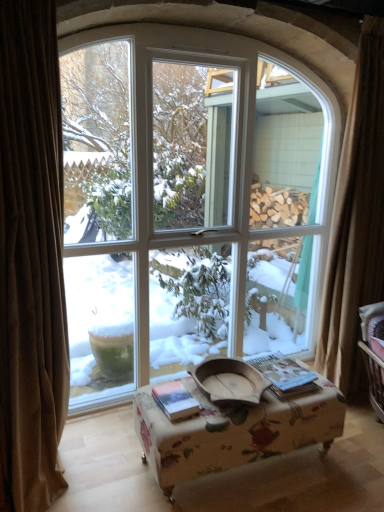
Question: From the image's perspective, is hardcover book at center, marked as the 1th book in a left-to-right arrangement, over brown curtain at right, marked as the second curtain in a left-to-right arrangement?

Choices:
 (A) no
 (B) yes

Answer: (A)

Question: From the image's perspective, is hardcover book at center, marked as the 1th book in a left-to-right arrangement, under brown curtain at right, marked as the first curtain in a back-to-front arrangement?

Choices:
 (A) no
 (B) yes

Answer: (B)

Question: Could you tell me if hardcover book at center, marked as the 1th book in a left-to-right arrangement, is facing brown curtain at right, which is the second curtain from front to back?

Choices:
 (A) yes
 (B) no

Answer: (B)

Question: Considering the relative sizes of hardcover book at center, the 2th book in the right-to-left sequence, and brown curtain at right, marked as the first curtain in a back-to-front arrangement, in the image provided, is hardcover book at center, the 2th book in the right-to-left sequence, shorter than brown curtain at right, marked as the first curtain in a back-to-front arrangement,?

Choices:
 (A) no
 (B) yes

Answer: (B)

Question: Could brown curtain at right, marked as the second curtain in a left-to-right arrangement, be considered to be inside hardcover book at center, the 2th book in the right-to-left sequence?

Choices:
 (A) yes
 (B) no

Answer: (B)

Question: Is point (39, 349) positioned closer to the camera than point (198, 411)?

Choices:
 (A) closer
 (B) farther

Answer: (A)

Question: Visually, is brown velvet curtain at left, the second curtain positioned from the right, positioned to the left or to the right of hardcover book at center, the 2th book in the right-to-left sequence?

Choices:
 (A) right
 (B) left

Answer: (B)

Question: From the image's perspective, is brown velvet curtain at left, positioned as the first curtain in left-to-right order, located above or below hardcover book at center, the 2th book in the right-to-left sequence?

Choices:
 (A) below
 (B) above

Answer: (B)

Question: From a real-world perspective, is brown velvet curtain at left, marked as the second curtain in a back-to-front arrangement, above or below hardcover book at center, marked as the 1th book in a left-to-right arrangement?

Choices:
 (A) above
 (B) below

Answer: (A)

Question: Is white glass window at center in front of or behind hardcover book at center, the 2th book positioned from the left, in the image?

Choices:
 (A) behind
 (B) front

Answer: (B)

Question: Do you think white glass window at center is within hardcover book at center, the 2th book positioned from the left, or outside of it?

Choices:
 (A) inside
 (B) outside

Answer: (B)

Question: In terms of width, does white glass window at center look wider or thinner when compared to hardcover book at center, acting as the first book starting from the right?

Choices:
 (A) thin
 (B) wide

Answer: (B)

Question: Looking at the image, does white glass window at center seem bigger or smaller compared to hardcover book at center, the 2th book positioned from the left?

Choices:
 (A) small
 (B) big

Answer: (B)

Question: From the image's perspective, is hardcover book at center, marked as the 1th book in a left-to-right arrangement, located above or below floral fabric ottoman at center?

Choices:
 (A) above
 (B) below

Answer: (A)

Question: Based on their sizes in the image, would you say hardcover book at center, marked as the 1th book in a left-to-right arrangement, is bigger or smaller than floral fabric ottoman at center?

Choices:
 (A) big
 (B) small

Answer: (B)